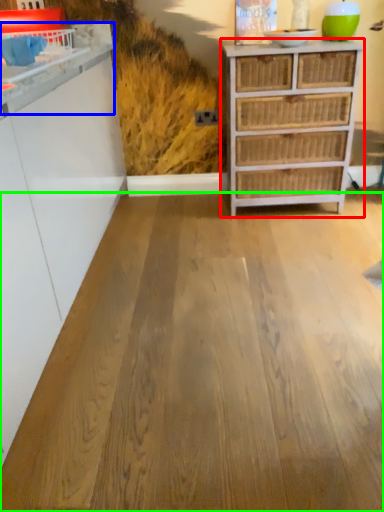
Question: Which object is positioned farthest from chest of drawers (highlighted by a red box)? Select from counter (highlighted by a blue box) and plywood (highlighted by a green box).

Choices:
 (A) counter
 (B) plywood

Answer: (A)